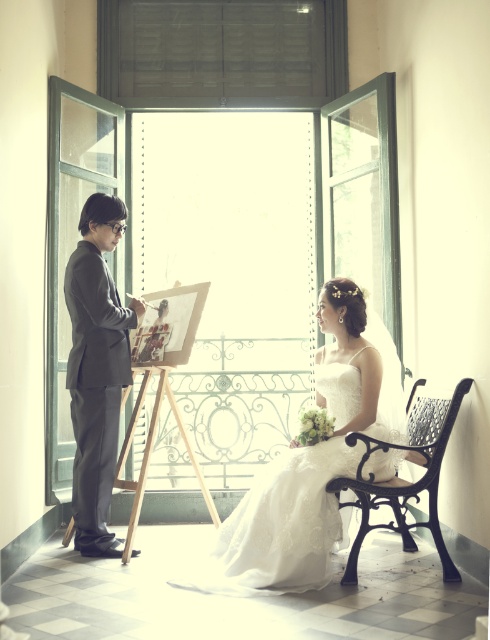
Is point (331, 360) positioned behind point (103, 444)?

No, (331, 360) is in front of (103, 444).

Can you confirm if white lace dress at center is positioned above gray suit at left?

Actually, white lace dress at center is below gray suit at left.

Between point (270, 483) and point (86, 516), which one is positioned behind?

Positioned behind is point (86, 516).

At what (x,y) coordinates should I click in order to perform the action: click on white lace dress at center. Please return your answer as a coordinate pair (x, y). The image size is (490, 640). Looking at the image, I should click on (310, 464).

Find the location of a particular element. This screenshot has height=640, width=490. gray suit at left is located at coordinates (97, 369).

Can you confirm if gray suit at left is wider than black wrought iron bench at lower right?

No, gray suit at left is not wider than black wrought iron bench at lower right.

Does point (117, 360) come farther from viewer compared to point (426, 419)?

Yes, it is.

In order to click on gray suit at left in this screenshot , I will do [x=97, y=369].

Between point (392, 422) and point (365, 484), which one is positioned behind?

Point (392, 422)

Can you confirm if white lace dress at center is positioned to the right of black wrought iron bench at lower right?

Incorrect, white lace dress at center is not on the right side of black wrought iron bench at lower right.

In the scene shown: Who is more distant from viewer, (358,349) or (397,525)?

Positioned behind is point (397,525).

Locate an element on the screen. white lace dress at center is located at coordinates (310, 464).